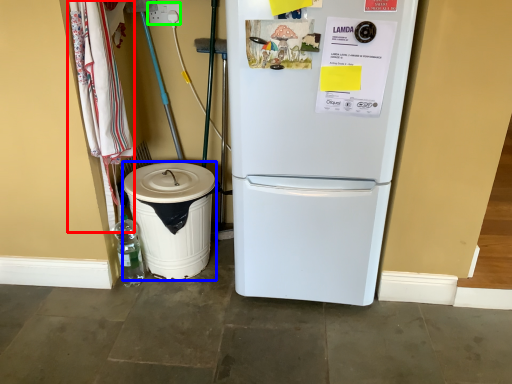
Question: Which object is positioned closest to laundry (highlighted by a red box)? Select from trash bin/can (highlighted by a blue box) and electric outlet (highlighted by a green box).

Choices:
 (A) trash bin/can
 (B) electric outlet

Answer: (A)